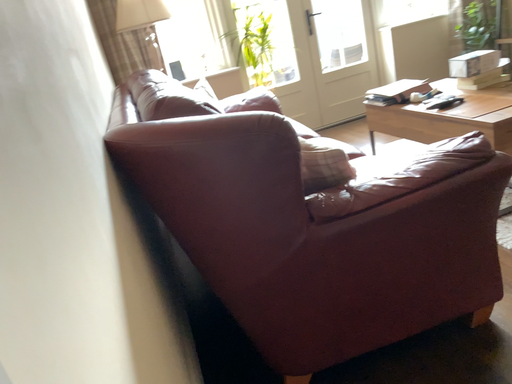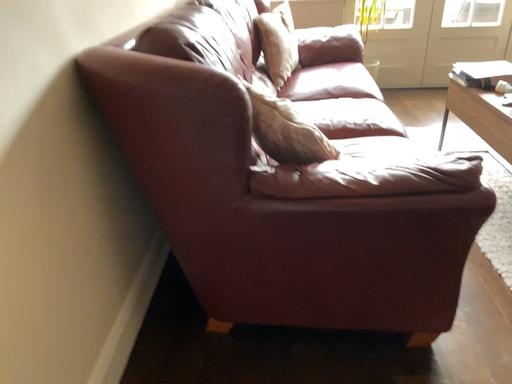
Question: How did the camera likely rotate when shooting the video?

Choices:
 (A) rotated right
 (B) rotated left

Answer: (B)